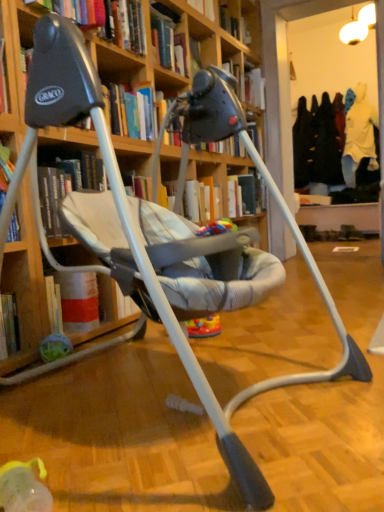
Question: Can you confirm if wooden bookcase at center is taller than hardcover book at upper center, placed as the second book when sorted from bottom to top?

Choices:
 (A) no
 (B) yes

Answer: (B)

Question: From a real-world perspective, is wooden bookcase at center located beneath hardcover book at upper center, positioned as the 3th book in right-to-left order?

Choices:
 (A) no
 (B) yes

Answer: (B)

Question: Is wooden bookcase at center at the left side of hardcover book at upper center, which appears as the first book when viewed from the front?

Choices:
 (A) no
 (B) yes

Answer: (A)

Question: Is wooden bookcase at center next to hardcover book at upper center, placed as the third book when sorted from back to front, and touching it?

Choices:
 (A) no
 (B) yes

Answer: (A)

Question: From the image's perspective, would you say wooden bookcase at center is positioned over hardcover book at upper center, which appears as the first book when viewed from the front?

Choices:
 (A) yes
 (B) no

Answer: (B)

Question: Does point (91, 122) appear closer or farther from the camera than point (210, 232)?

Choices:
 (A) closer
 (B) farther

Answer: (A)

Question: From a real-world perspective, is hardcover book at upper center, marked as the 1th book in a bottom-to-top arrangement, above or below multicolored plastic toy at center?

Choices:
 (A) above
 (B) below

Answer: (A)

Question: From the image's perspective, is hardcover book at upper center, marked as the 1th book in a bottom-to-top arrangement, positioned above or below multicolored plastic toy at center?

Choices:
 (A) above
 (B) below

Answer: (A)

Question: Looking at the image, does hardcover book at upper center, which appears as the second book when viewed from the back, seem bigger or smaller compared to multicolored plastic toy at center?

Choices:
 (A) small
 (B) big

Answer: (B)

Question: Is hardcover book at upper center, the third book when ordered from left to right, wider or thinner than wooden bookcase at center?

Choices:
 (A) thin
 (B) wide

Answer: (A)

Question: Do you think hardcover book at upper center, the third book when ordered from left to right, is within wooden bookcase at center, or outside of it?

Choices:
 (A) inside
 (B) outside

Answer: (B)

Question: From the image's perspective, is hardcover book at upper center, the 1th book positioned from the right, located above or below wooden bookcase at center?

Choices:
 (A) below
 (B) above

Answer: (B)

Question: Considering the positions of hardcover book at upper center, which is the third book in front-to-back order, and wooden bookcase at center in the image, is hardcover book at upper center, which is the third book in front-to-back order, taller or shorter than wooden bookcase at center?

Choices:
 (A) tall
 (B) short

Answer: (B)

Question: In the image, is multicolored plastic toy at center positioned in front of or behind hardcover book at upper center, which is the 2th book in front-to-back order?

Choices:
 (A) behind
 (B) front

Answer: (B)

Question: Is multicolored plastic toy at center wider or thinner than hardcover book at upper center, the 3th book viewed from the top?

Choices:
 (A) thin
 (B) wide

Answer: (A)